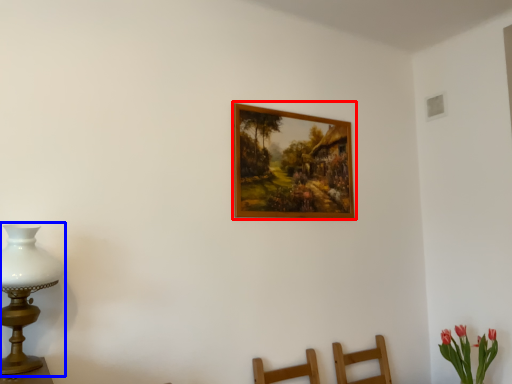
Question: Which object is further to the camera taking this photo, picture frame (highlighted by a red box) or table lamp (highlighted by a blue box)?

Choices:
 (A) picture frame
 (B) table lamp

Answer: (A)